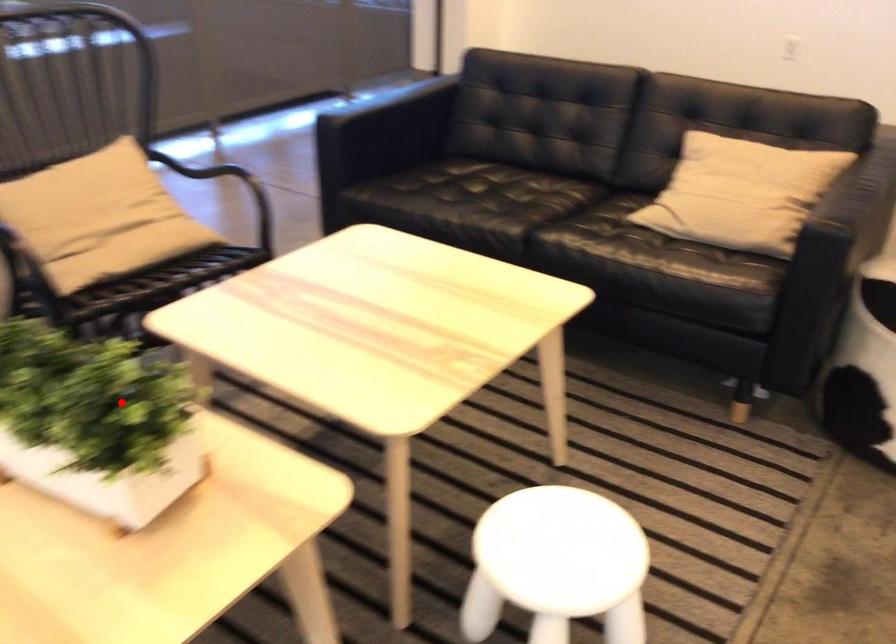
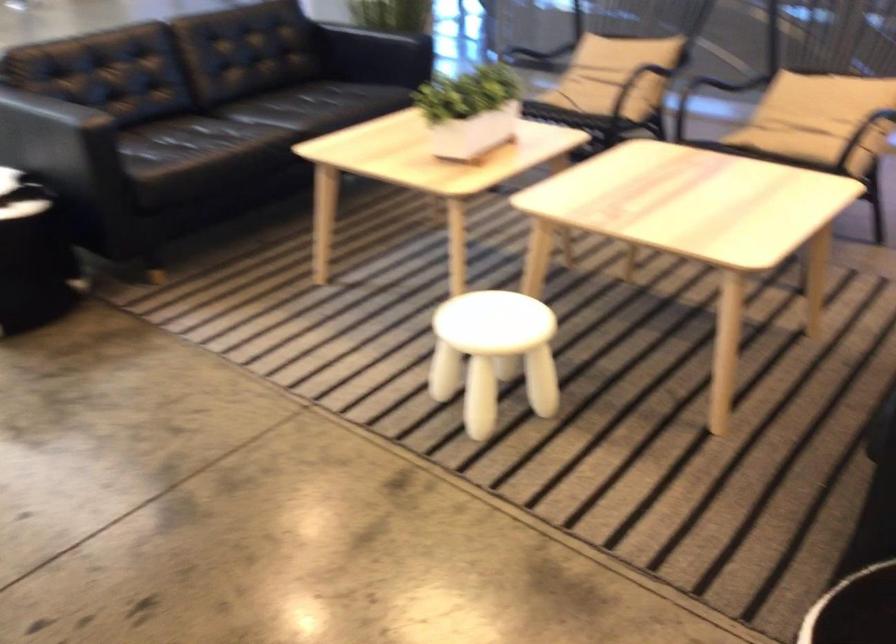
Question: A red point is marked in image1. In image2, is the corresponding 3D point closer to the camera or farther? Reply with the corresponding letter.

Choices:
 (A) The corresponding 3D point is closer.
 (B) The corresponding 3D point is farther.

Answer: (B)